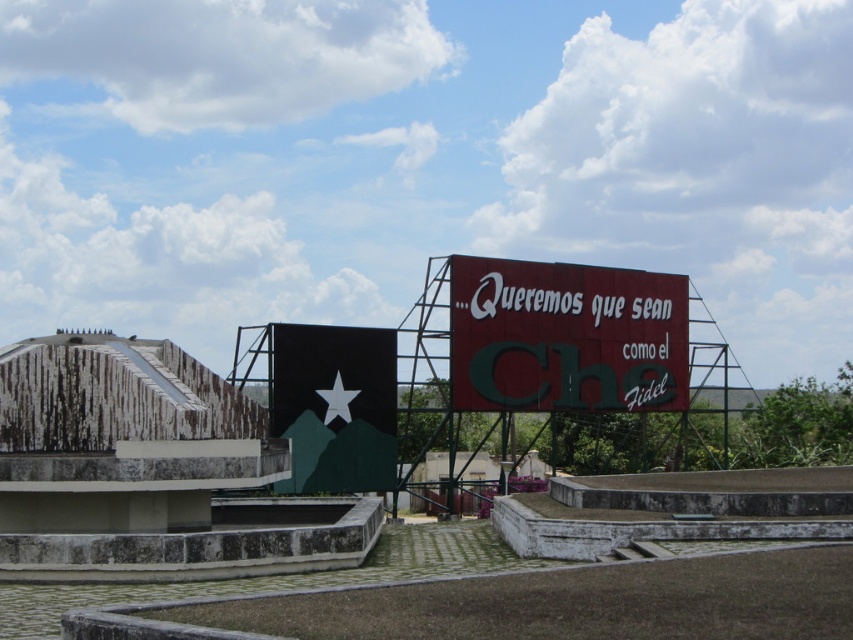
You are a tour guide explaining the monuments in the image. You mention both the green concrete sign at upper center and the black matte sign at center. Which one do you need to point to first if you want to discuss the larger one?

The green concrete sign at upper center is bigger than the black matte sign at center, so you should point to the green concrete sign at upper center first.

You are a tour guide explaining the historical significance of the signs in the monument complex. You mention both the green concrete sign at upper center and the red matte sign at upper right. Which of these two signs is taller?

The green concrete sign at upper center is taller than the red matte sign at upper right according to the description provided.